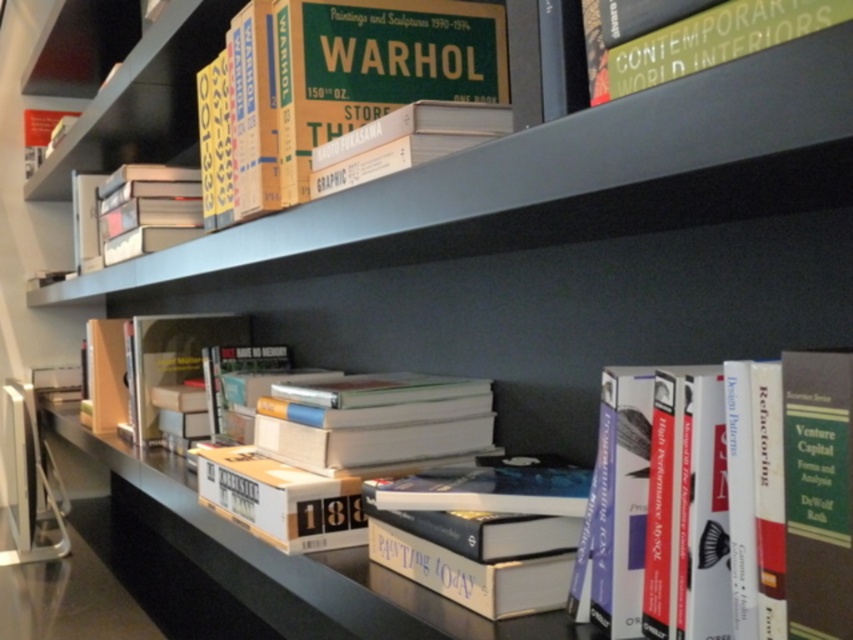
You are organizing a bookshelf and need to place a new book that is 3 inches tall. You see the hardcover book at center and the hardcover book at upper right. Which existing book can the new book fit under if placed on the shelf?

Answer: The new book that is 3 inches tall can fit under the hardcover book at upper right because the hardcover book at center has a greater height compared to hardcover book at upper right.

You are a librarian trying to place a new book on the shelf. You notice the metallic gray shelf at upper center and the hardcover book at center. Which one is closer to you?

The metallic gray shelf at upper center is closer to the viewer than the hardcover book at center, so the metallic gray shelf at upper center is closer to you.

You are organizing books on a bookshelf and need to place a new book. The metallic gray shelf at upper center and the hardcover book at center are both in your view. Which one is bigger in size?

The metallic gray shelf at upper center has a larger size compared to the hardcover book at center, so the metallic gray shelf at upper center is bigger.